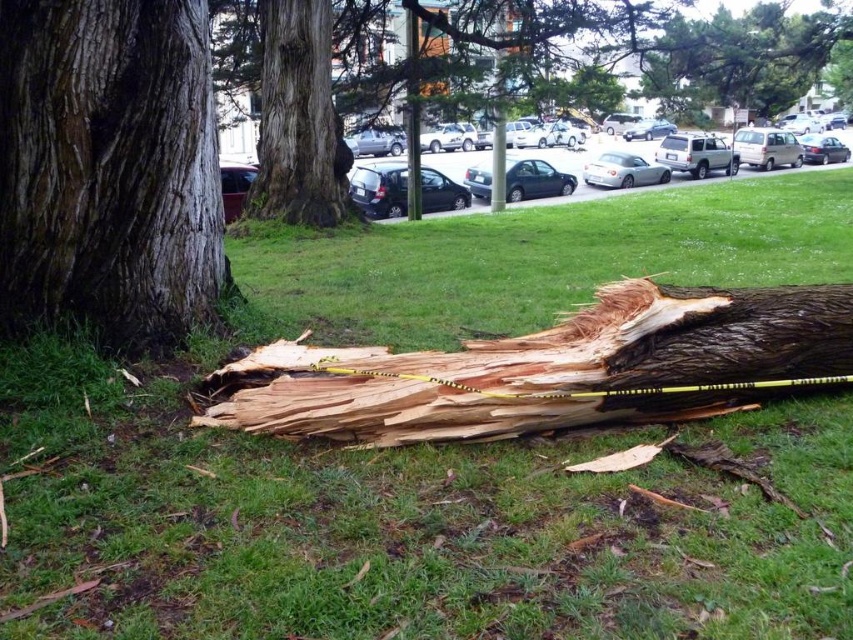
Question: Among these objects, which one is nearest to the camera?

Choices:
 (A) natural wood log at lower center
 (B) green grass at lower center

Answer: (B)

Question: Which point appears farthest from the camera in this image?

Choices:
 (A) (700, 326)
 (B) (141, 221)
 (C) (135, 561)
 (D) (314, 179)

Answer: (D)

Question: Which point is farther to the camera?

Choices:
 (A) smooth brown tree trunk at center
 (B) green grass at lower center
 (C) natural wood log at center

Answer: (A)

Question: From the image, what is the correct spatial relationship of dark brown rough bark at center in relation to smooth brown tree trunk at center?

Choices:
 (A) left
 (B) right

Answer: (B)

Question: Does green grass at lower center come in front of smooth brown tree trunk at center?

Choices:
 (A) yes
 (B) no

Answer: (A)

Question: Can you confirm if dark brown rough bark at center is positioned below natural wood log at center?

Choices:
 (A) yes
 (B) no

Answer: (B)